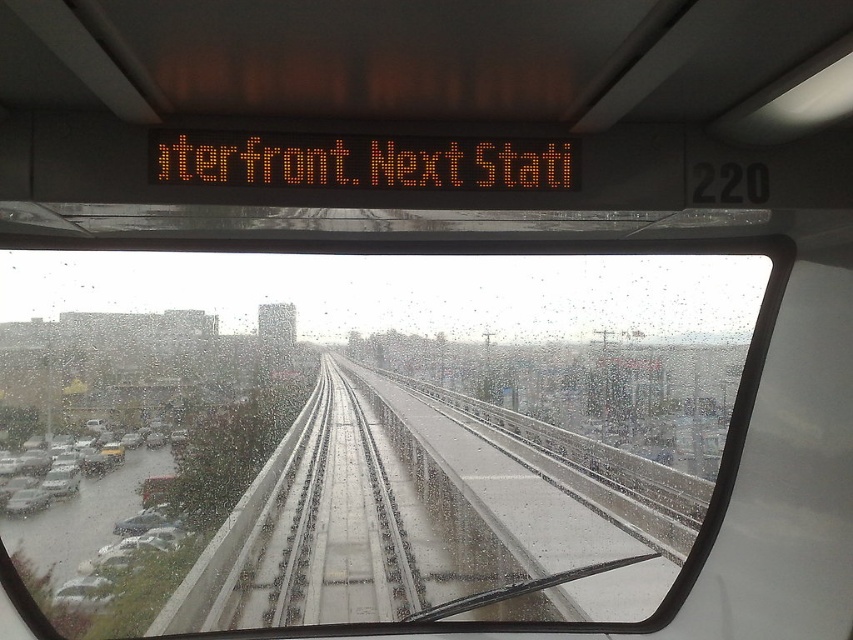
Question: Does transparent glass windshield at center lie in front of matte silver car at lower left?

Choices:
 (A) yes
 (B) no

Answer: (A)

Question: Can you confirm if transparent glass windshield at center is wider than matte silver car at lower left?

Choices:
 (A) yes
 (B) no

Answer: (A)

Question: Which object is closer to the camera taking this photo?

Choices:
 (A) matte silver car at lower left
 (B) transparent glass windshield at center

Answer: (B)

Question: Which object appears closest to the camera in this image?

Choices:
 (A) transparent glass windshield at center
 (B) matte silver car at lower left

Answer: (A)

Question: Among these objects, which one is nearest to the camera?

Choices:
 (A) transparent glass windshield at center
 (B) matte silver car at lower left

Answer: (A)

Question: Does transparent glass windshield at center come in front of matte silver car at lower left?

Choices:
 (A) no
 (B) yes

Answer: (B)